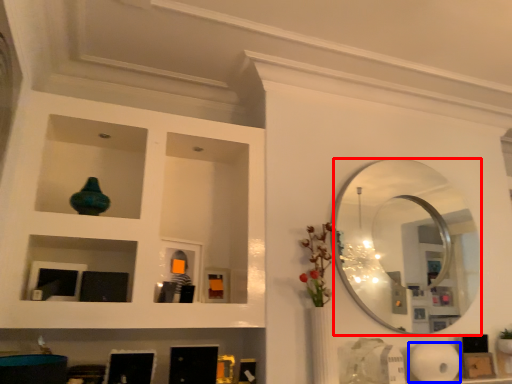
Question: Which object is closer to the camera taking this photo, mirror (highlighted by a red box) or paper towel (highlighted by a blue box)?

Choices:
 (A) mirror
 (B) paper towel

Answer: (B)